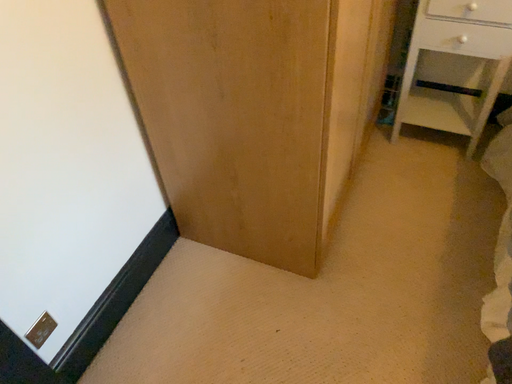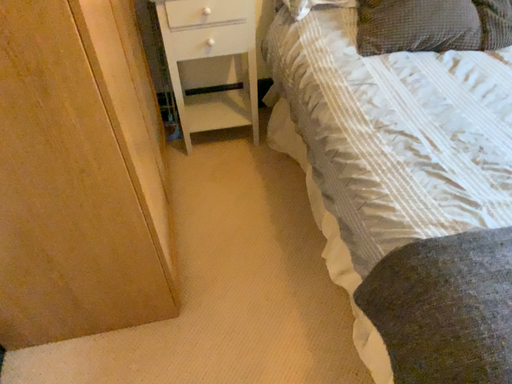
Question: How did the camera likely rotate when shooting the video?

Choices:
 (A) rotated upward
 (B) rotated downward

Answer: (A)